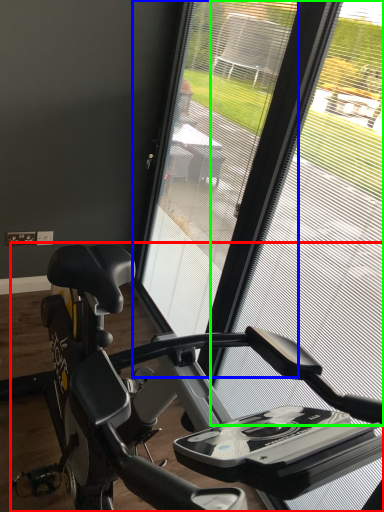
Question: Which is farther away from stationary bicycle (highlighted by a red box)? screen door (highlighted by a blue box) or window screen (highlighted by a green box)?

Choices:
 (A) screen door
 (B) window screen

Answer: (B)